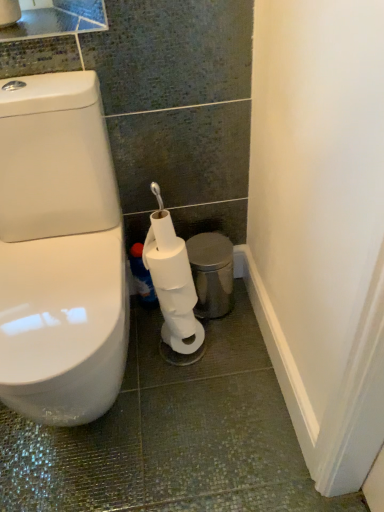
Locate an element on the screen. Image resolution: width=384 pixels, height=512 pixels. white matte toilet paper at lower center is located at coordinates [x=173, y=284].

Image resolution: width=384 pixels, height=512 pixels. Describe the element at coordinates (173, 284) in the screenshot. I see `white matte toilet paper at lower center` at that location.

Describe the element at coordinates (142, 277) in the screenshot. The width and height of the screenshot is (384, 512). I see `blue glossy bottle at lower center` at that location.

The width and height of the screenshot is (384, 512). In order to click on metallic silver trash can at lower right in this screenshot , I will do `click(212, 273)`.

Looking at this image, measure the distance from blue glossy bottle at lower center to white matte toilet paper at lower center.

blue glossy bottle at lower center is 9.28 inches from white matte toilet paper at lower center.

Is blue glossy bottle at lower center directly adjacent to white matte toilet paper at lower center?

No, blue glossy bottle at lower center is not with white matte toilet paper at lower center.

Who is smaller, blue glossy bottle at lower center or white matte toilet paper at lower center?

With smaller size is blue glossy bottle at lower center.

From the image's perspective, which object appears higher, blue glossy bottle at lower center or white matte toilet paper at lower center?

blue glossy bottle at lower center.

From the image's perspective, is white matte toilet paper at lower center on metallic silver trash can at lower right?

No, from the image's perspective, white matte toilet paper at lower center is not over metallic silver trash can at lower right.

What are the coordinates of `porcelain above the white matte toilet paper at lower center (from the image's perspective)` in the screenshot? It's located at (212, 273).

Considering the sizes of objects white matte toilet paper at lower center and metallic silver trash can at lower right in the image provided, who is thinner, white matte toilet paper at lower center or metallic silver trash can at lower right?

Thinner between the two is metallic silver trash can at lower right.

Does point (191, 310) come behind point (231, 255)?

No, it is in front of (231, 255).

Considering the positions of objects blue glossy bottle at lower center and metallic silver trash can at lower right in the image provided, who is behind, blue glossy bottle at lower center or metallic silver trash can at lower right?

blue glossy bottle at lower center is further from the camera.

Is blue glossy bottle at lower center positioned far away from metallic silver trash can at lower right?

No, there isn't a large distance between blue glossy bottle at lower center and metallic silver trash can at lower right.

Looking at the image, does blue glossy bottle at lower center seem bigger or smaller compared to metallic silver trash can at lower right?

Considering their sizes, blue glossy bottle at lower center takes up less space than metallic silver trash can at lower right.

Is metallic silver trash can at lower right outside of blue glossy bottle at lower center?

Yes.

The height and width of the screenshot is (512, 384). Identify the location of cleaning product behind the metallic silver trash can at lower right. (142, 277).

From a real-world perspective, is metallic silver trash can at lower right physically above blue glossy bottle at lower center?

Actually, metallic silver trash can at lower right is physically below blue glossy bottle at lower center in the real world.

Is metallic silver trash can at lower right shorter than blue glossy bottle at lower center?

In fact, metallic silver trash can at lower right may be taller than blue glossy bottle at lower center.

Is metallic silver trash can at lower right taller or shorter than white matte toilet paper at lower center?

In the image, metallic silver trash can at lower right appears to be shorter than white matte toilet paper at lower center.

Considering the sizes of objects metallic silver trash can at lower right and white matte toilet paper at lower center in the image provided, who is thinner, metallic silver trash can at lower right or white matte toilet paper at lower center?

With smaller width is metallic silver trash can at lower right.

Which is behind, metallic silver trash can at lower right or white matte toilet paper at lower center?

metallic silver trash can at lower right is further away from the camera.

You are a GUI agent. You are given a task and a screenshot of the screen. Output one action in this format:
    pyautogui.click(x=<x>, y=<y>)
    Task: Click on the toilet paper below the metallic silver trash can at lower right (from the image's perspective)
    
    Given the screenshot: What is the action you would take?
    pyautogui.click(x=173, y=284)

How different are the orientations of white matte toilet paper at lower center and blue glossy bottle at lower center in degrees?

The angular difference between white matte toilet paper at lower center and blue glossy bottle at lower center is 89 degrees.

Consider the image. Is white matte toilet paper at lower center not within blue glossy bottle at lower center?

white matte toilet paper at lower center is positioned outside blue glossy bottle at lower center.

Which is behind, white matte toilet paper at lower center or blue glossy bottle at lower center?

blue glossy bottle at lower center is further away from the camera.

Does white matte toilet paper at lower center have a lesser height compared to blue glossy bottle at lower center?

No.

The height and width of the screenshot is (512, 384). I want to click on cleaning product lying above the white matte toilet paper at lower center (from the image's perspective), so click(142, 277).

This screenshot has width=384, height=512. In order to click on toilet paper that appears below the metallic silver trash can at lower right (from the image's perspective) in this screenshot , I will do `click(173, 284)`.

When comparing their distances from white matte toilet paper at lower center, does metallic silver trash can at lower right or blue glossy bottle at lower center seem closer?

Among the two, metallic silver trash can at lower right is located nearer to white matte toilet paper at lower center.

From the image, which object appears to be farther from metallic silver trash can at lower right, white matte toilet paper at lower center or blue glossy bottle at lower center?

blue glossy bottle at lower center lies further to metallic silver trash can at lower right than the other object.

Which object lies nearer to the anchor point white matte toilet paper at lower center, blue glossy bottle at lower center or metallic silver trash can at lower right?

The object closer to white matte toilet paper at lower center is metallic silver trash can at lower right.

Based on their spatial positions, is white matte toilet paper at lower center or metallic silver trash can at lower right further from blue glossy bottle at lower center?

Based on the image, white matte toilet paper at lower center appears to be further to blue glossy bottle at lower center.

Looking at the image, which one is located further to metallic silver trash can at lower right, blue glossy bottle at lower center or white matte toilet paper at lower center?

blue glossy bottle at lower center.

Estimate the real-world distances between objects in this image. Which object is closer to blue glossy bottle at lower center, metallic silver trash can at lower right or white matte toilet paper at lower center?

metallic silver trash can at lower right.

Where is `porcelain between white matte toilet paper at lower center and blue glossy bottle at lower center in the front-back direction`? porcelain between white matte toilet paper at lower center and blue glossy bottle at lower center in the front-back direction is located at coordinates (212, 273).